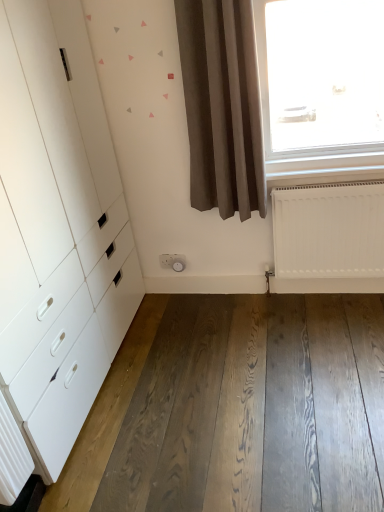
This screenshot has width=384, height=512. Describe the element at coordinates (237, 409) in the screenshot. I see `dark brown wood flooring at lower center` at that location.

Where is `brown matte curtain at center`? brown matte curtain at center is located at coordinates (222, 106).

Is point (159, 256) positioned in front of point (186, 45)?

No, it is not.

From the image's perspective, is white plastic socket at center above brown matte curtain at center?

No, from the image's perspective, white plastic socket at center is not over brown matte curtain at center.

Which is more to the left, white plastic socket at center or brown matte curtain at center?

From the viewer's perspective, white plastic socket at center appears more on the left side.

Based on the photo, from their relative heights in the image, would you say white plastic socket at center is taller or shorter than brown matte curtain at center?

Clearly, white plastic socket at center is shorter compared to brown matte curtain at center.

I want to click on radiator below the white matte chest of drawers at left (from the image's perspective), so click(328, 239).

Looking at this image, who is shorter, white matte chest of drawers at left or white matte radiator at lower right?

With less height is white matte radiator at lower right.

Which object is further away from the camera taking this photo, white matte chest of drawers at left or white matte radiator at lower right?

white matte radiator at lower right.

Can you confirm if dark brown wood flooring at lower center is taller than white matte chest of drawers at left?

No.

At what (x,y) coordinates should I click in order to perform the action: click on the chest of drawers lying above the dark brown wood flooring at lower center (from the image's perspective). Please return your answer as a coordinate pair (x, y). The width and height of the screenshot is (384, 512). Looking at the image, I should click on [58, 229].

Would you say white matte radiator at lower right contains white matte chest of drawers at left?

That's incorrect, white matte chest of drawers at left is not inside white matte radiator at lower right.

Considering the points (364, 185) and (109, 313), which point is in front, point (364, 185) or point (109, 313)?

The point (364, 185) is closer.

Is white matte radiator at lower right positioned with its back to white matte chest of drawers at left?

No, white matte chest of drawers at left is not at the back of white matte radiator at lower right.

You are a GUI agent. You are given a task and a screenshot of the screen. Output one action in this format:
    pyautogui.click(x=<x>, y=<y>)
    Task: Click on the radiator below the white matte chest of drawers at left (from the image's perspective)
    
    Given the screenshot: What is the action you would take?
    pyautogui.click(x=328, y=239)

Can you confirm if white plastic socket at center is thinner than dark brown wood flooring at lower center?

Indeed, white plastic socket at center has a lesser width compared to dark brown wood flooring at lower center.

Which of these two, white plastic socket at center or dark brown wood flooring at lower center, is smaller?

white plastic socket at center is smaller.

Is white plastic socket at center closer to the viewer compared to dark brown wood flooring at lower center?

No.

Is brown matte curtain at center next to white matte radiator at lower right?

brown matte curtain at center and white matte radiator at lower right are clearly separated.

Identify the location of radiator on the right of brown matte curtain at center. The height and width of the screenshot is (512, 384). (328, 239).

Is brown matte curtain at center inside the boundaries of white matte radiator at lower right, or outside?

The correct answer is: outside.

Which point is more forward, (206, 207) or (294, 250)?

The point (206, 207) is more forward.

Is brown matte curtain at center turned away from white matte chest of drawers at left?

No, white matte chest of drawers at left is not at the back of brown matte curtain at center.

In terms of height, does brown matte curtain at center look taller or shorter compared to white matte chest of drawers at left?

In the image, brown matte curtain at center appears to be shorter than white matte chest of drawers at left.

From a real-world perspective, is brown matte curtain at center over white matte chest of drawers at left?

Yes, from a real-world perspective, brown matte curtain at center is over white matte chest of drawers at left

Where is `electric outlet lying behind the brown matte curtain at center`? electric outlet lying behind the brown matte curtain at center is located at coordinates (173, 262).

The width and height of the screenshot is (384, 512). Find the location of `the chest of drawers that appears above the white matte radiator at lower right (from the image's perspective)`. the chest of drawers that appears above the white matte radiator at lower right (from the image's perspective) is located at coordinates 58,229.

Considering their positions, is white matte chest of drawers at left positioned closer to white matte radiator at lower right than dark brown wood flooring at lower center?

dark brown wood flooring at lower center.

Based on their spatial positions, is dark brown wood flooring at lower center or white matte radiator at lower right further from brown matte curtain at center?

dark brown wood flooring at lower center is positioned further to the anchor brown matte curtain at center.

When comparing their distances from dark brown wood flooring at lower center, does white plastic socket at center or white matte radiator at lower right seem further?

white plastic socket at center lies further to dark brown wood flooring at lower center than the other object.

Considering their positions, is white plastic socket at center positioned further to white matte radiator at lower right than brown matte curtain at center?

The object further to white matte radiator at lower right is white plastic socket at center.

Which object lies further to the anchor point white matte chest of drawers at left, brown matte curtain at center or dark brown wood flooring at lower center?

dark brown wood flooring at lower center is further to white matte chest of drawers at left.

Based on their spatial positions, is brown matte curtain at center or white plastic socket at center further from dark brown wood flooring at lower center?

The object further to dark brown wood flooring at lower center is brown matte curtain at center.

When comparing their distances from dark brown wood flooring at lower center, does brown matte curtain at center or white matte chest of drawers at left seem closer?

Among the two, white matte chest of drawers at left is located nearer to dark brown wood flooring at lower center.

When comparing their distances from white matte radiator at lower right, does brown matte curtain at center or white plastic socket at center seem closer?

Among the two, brown matte curtain at center is located nearer to white matte radiator at lower right.

Locate an element on the screen. Image resolution: width=384 pixels, height=512 pixels. curtain between white matte chest of drawers at left and white plastic socket at center along the z-axis is located at coordinates (222, 106).

Identify the location of radiator that lies between brown matte curtain at center and dark brown wood flooring at lower center from top to bottom. This screenshot has height=512, width=384. [328, 239].

You are a GUI agent. You are given a task and a screenshot of the screen. Output one action in this format:
    pyautogui.click(x=<x>, y=<y>)
    Task: Click on the radiator between brown matte curtain at center and white plastic socket at center along the z-axis
    
    Given the screenshot: What is the action you would take?
    tap(328, 239)

Where is `hardwood between white matte chest of drawers at left and white plastic socket at center in the front-back direction`? hardwood between white matte chest of drawers at left and white plastic socket at center in the front-back direction is located at coordinates (237, 409).